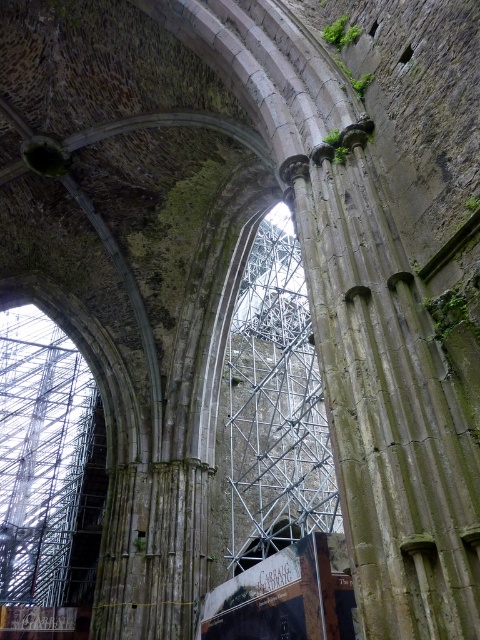
You are standing in the ancient stone structure and want to move from point A to point B. If point A is at point (339, 390) and point B is at point (278, 317), which direction should you move to reach point B?

To reach point B at (278, 317) from point A at (339, 390), you should move backward since point A is in front of point B according to their coordinates.